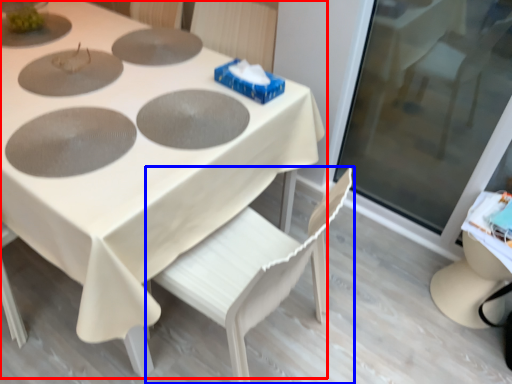
Question: Which object is further to the camera taking this photo, table (highlighted by a red box) or chair (highlighted by a blue box)?

Choices:
 (A) table
 (B) chair

Answer: (A)